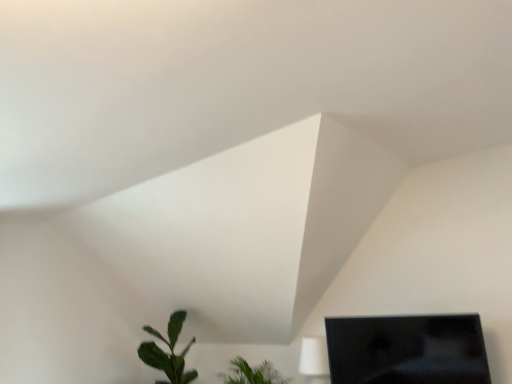
Where is `green matte leafy plant at lower left, which appears as the 2th houseplant when viewed from the right`? This screenshot has height=384, width=512. green matte leafy plant at lower left, which appears as the 2th houseplant when viewed from the right is located at coordinates (168, 354).

Where is `black glossy monitor at lower right`? black glossy monitor at lower right is located at coordinates (407, 350).

The width and height of the screenshot is (512, 384). I want to click on green matte leafy plant at lower left, which appears as the 2th houseplant when viewed from the right, so click(168, 354).

Where is `the 1st houseplant to the left when counting from the black glossy monitor at lower right`? The height and width of the screenshot is (384, 512). the 1st houseplant to the left when counting from the black glossy monitor at lower right is located at coordinates point(252,373).

Is black glossy monitor at lower right completely or partially inside green leafy plant at lower center, acting as the second houseplant starting from the left?

No, black glossy monitor at lower right is located outside of green leafy plant at lower center, acting as the second houseplant starting from the left.

Is green leafy plant at lower center, acting as the second houseplant starting from the left, closer to camera compared to black glossy monitor at lower right?

That is False.

Is green leafy plant at lower center, the 1th houseplant positioned from the right, far away from black glossy monitor at lower right?

Yes, green leafy plant at lower center, the 1th houseplant positioned from the right, and black glossy monitor at lower right are quite far apart.

Consider the image. From a real-world perspective, does green matte leafy plant at lower left, which is counted as the first houseplant, starting from the left, stand above black glossy monitor at lower right?

No, from a real-world perspective, green matte leafy plant at lower left, which is counted as the first houseplant, starting from the left, is not above black glossy monitor at lower right.

How different are the orientations of green matte leafy plant at lower left, which appears as the 2th houseplant when viewed from the right, and black glossy monitor at lower right in degrees?

green matte leafy plant at lower left, which appears as the 2th houseplant when viewed from the right, and black glossy monitor at lower right are facing 1.6 degrees away from each other.

Which is behind, point (182, 358) or point (453, 370)?

The point (182, 358) is more distant.

Would you say green matte leafy plant at lower left, which appears as the 2th houseplant when viewed from the right, is inside or outside black glossy monitor at lower right?

green matte leafy plant at lower left, which appears as the 2th houseplant when viewed from the right, is located beyond the bounds of black glossy monitor at lower right.

Is point (246, 362) closer or farther from the camera than point (167, 333)?

Clearly, point (246, 362) is closer to the camera than point (167, 333).

Can you confirm if green leafy plant at lower center, acting as the second houseplant starting from the left, is thinner than green matte leafy plant at lower left, which is counted as the first houseplant, starting from the left?

No, green leafy plant at lower center, acting as the second houseplant starting from the left, is not thinner than green matte leafy plant at lower left, which is counted as the first houseplant, starting from the left.

From a real-world perspective, which object stands above the other?

In real-world perspective, green matte leafy plant at lower left, which appears as the 2th houseplant when viewed from the right, is above.

Which is more to the right, green matte leafy plant at lower left, which appears as the 2th houseplant when viewed from the right, or green leafy plant at lower center, acting as the second houseplant starting from the left?

green leafy plant at lower center, acting as the second houseplant starting from the left, is more to the right.

Which object is more forward, green matte leafy plant at lower left, which is counted as the first houseplant, starting from the left, or green leafy plant at lower center, the 1th houseplant positioned from the right?

Positioned in front is green leafy plant at lower center, the 1th houseplant positioned from the right.

Is green matte leafy plant at lower left, which is counted as the first houseplant, starting from the left, wider or thinner than green leafy plant at lower center, the 1th houseplant positioned from the right?

green matte leafy plant at lower left, which is counted as the first houseplant, starting from the left, is thinner than green leafy plant at lower center, the 1th houseplant positioned from the right.

Is green matte leafy plant at lower left, which is counted as the first houseplant, starting from the left, facing towards green leafy plant at lower center, acting as the second houseplant starting from the left?

No.

Between black glossy monitor at lower right and green matte leafy plant at lower left, which appears as the 2th houseplant when viewed from the right, which one has smaller width?

black glossy monitor at lower right.

Can you confirm if black glossy monitor at lower right is positioned to the right of green matte leafy plant at lower left, which appears as the 2th houseplant when viewed from the right?

Indeed, black glossy monitor at lower right is positioned on the right side of green matte leafy plant at lower left, which appears as the 2th houseplant when viewed from the right.

Which object is more forward, black glossy monitor at lower right or green matte leafy plant at lower left, which appears as the 2th houseplant when viewed from the right?

black glossy monitor at lower right.

There is a green leafy plant at lower center, acting as the second houseplant starting from the left. In order to click on computer monitor above it (from a real-world perspective) in this screenshot , I will do coord(407,350).

How many degrees apart are the facing directions of black glossy monitor at lower right and green leafy plant at lower center, acting as the second houseplant starting from the left?

The angle between the facing direction of black glossy monitor at lower right and the facing direction of green leafy plant at lower center, acting as the second houseplant starting from the left, is 0.279 degrees.

Is black glossy monitor at lower right oriented towards green leafy plant at lower center, acting as the second houseplant starting from the left?

No, black glossy monitor at lower right is not oriented towards green leafy plant at lower center, acting as the second houseplant starting from the left.

From a real-world perspective, which is physically above, black glossy monitor at lower right or green leafy plant at lower center, acting as the second houseplant starting from the left?

black glossy monitor at lower right is physically above.

I want to click on computer monitor that appears on the right of green leafy plant at lower center, the 1th houseplant positioned from the right, so click(x=407, y=350).

You are a GUI agent. You are given a task and a screenshot of the screen. Output one action in this format:
    pyautogui.click(x=<x>, y=<y>)
    Task: Click on the houseplant that is the 2nd one when counting downward from the black glossy monitor at lower right (from the image's perspective)
    
    Given the screenshot: What is the action you would take?
    pyautogui.click(x=168, y=354)

Considering their positions, is green matte leafy plant at lower left, which appears as the 2th houseplant when viewed from the right, positioned closer to green leafy plant at lower center, the 1th houseplant positioned from the right, than black glossy monitor at lower right?

Based on the image, green matte leafy plant at lower left, which appears as the 2th houseplant when viewed from the right, appears to be nearer to green leafy plant at lower center, the 1th houseplant positioned from the right.

Based on their spatial positions, is green leafy plant at lower center, the 1th houseplant positioned from the right, or green matte leafy plant at lower left, which appears as the 2th houseplant when viewed from the right, further from black glossy monitor at lower right?

The object further to black glossy monitor at lower right is green matte leafy plant at lower left, which appears as the 2th houseplant when viewed from the right.

Which object lies nearer to the anchor point green matte leafy plant at lower left, which appears as the 2th houseplant when viewed from the right, green leafy plant at lower center, the 1th houseplant positioned from the right, or black glossy monitor at lower right?

Among the two, green leafy plant at lower center, the 1th houseplant positioned from the right, is located nearer to green matte leafy plant at lower left, which appears as the 2th houseplant when viewed from the right.

Based on their spatial positions, is black glossy monitor at lower right or green matte leafy plant at lower left, which is counted as the first houseplant, starting from the left, closer to green leafy plant at lower center, acting as the second houseplant starting from the left?

green matte leafy plant at lower left, which is counted as the first houseplant, starting from the left, is closer to green leafy plant at lower center, acting as the second houseplant starting from the left.

From the image, which object appears to be nearer to green matte leafy plant at lower left, which is counted as the first houseplant, starting from the left, black glossy monitor at lower right or green leafy plant at lower center, the 1th houseplant positioned from the right?

green leafy plant at lower center, the 1th houseplant positioned from the right, is positioned closer to the anchor green matte leafy plant at lower left, which is counted as the first houseplant, starting from the left.

Based on their spatial positions, is green matte leafy plant at lower left, which appears as the 2th houseplant when viewed from the right, or green leafy plant at lower center, acting as the second houseplant starting from the left, closer to black glossy monitor at lower right?

green leafy plant at lower center, acting as the second houseplant starting from the left, is positioned closer to the anchor black glossy monitor at lower right.

Locate an element on the screen. houseplant located between green matte leafy plant at lower left, which appears as the 2th houseplant when viewed from the right, and black glossy monitor at lower right in the left-right direction is located at coordinates (252, 373).